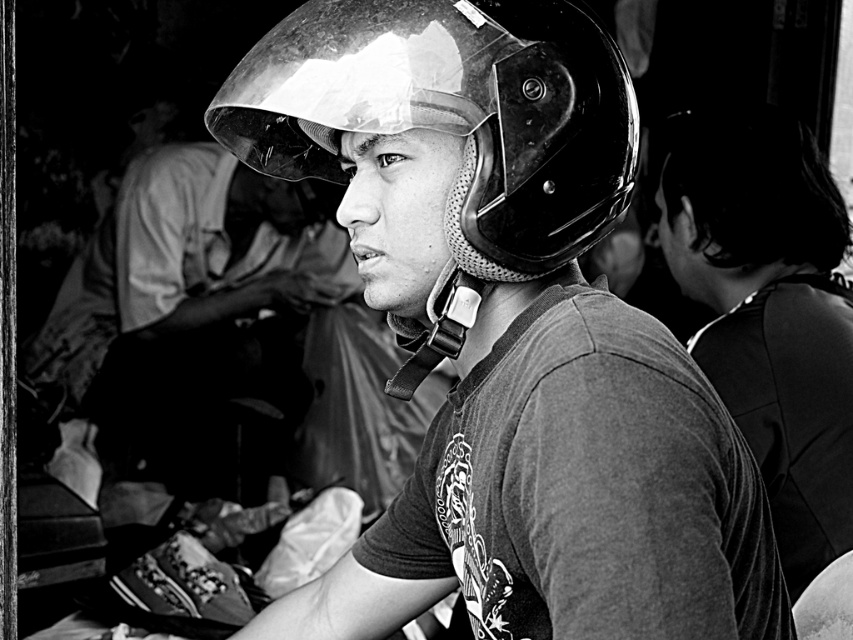
Question: Estimate the real-world distances between objects in this image. Which object is closer to the glossy black helmet at center?

Choices:
 (A) shiny black helmet at center
 (B) smooth black shirt at center

Answer: (A)

Question: Can you confirm if shiny black helmet at center is positioned below smooth black shirt at center?

Choices:
 (A) no
 (B) yes

Answer: (A)

Question: Does glossy black helmet at center appear on the left side of shiny black helmet at center?

Choices:
 (A) yes
 (B) no

Answer: (A)

Question: Which object appears closest to the camera in this image?

Choices:
 (A) smooth black shirt at center
 (B) shiny black helmet at center

Answer: (B)

Question: Which of the following is the farthest from the observer?

Choices:
 (A) smooth black shirt at center
 (B) shiny black helmet at center
 (C) glossy black helmet at center

Answer: (A)

Question: Is glossy black helmet at center to the right of smooth black shirt at center from the viewer's perspective?

Choices:
 (A) yes
 (B) no

Answer: (B)